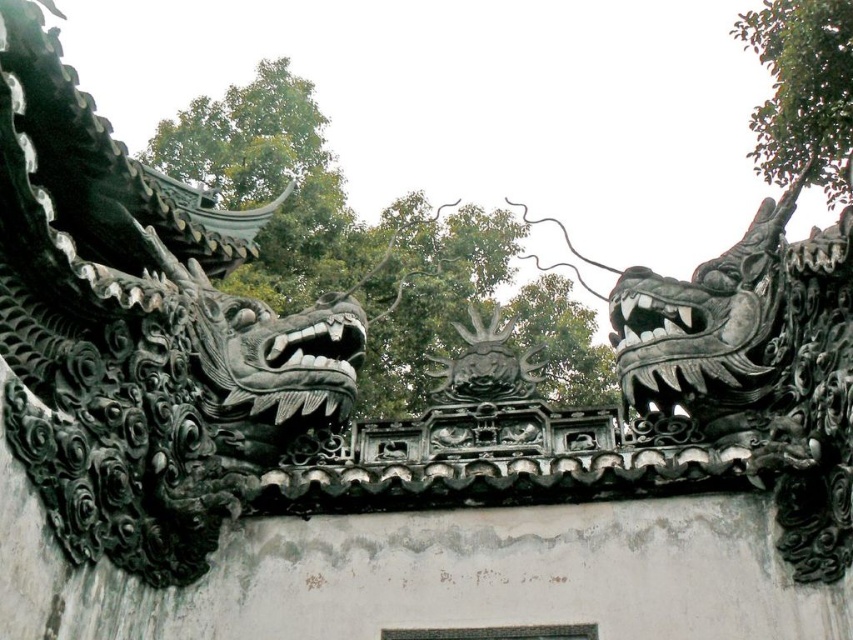
Question: Can you confirm if black stone dragon head at left is thinner than black matte dragon head at center?

Choices:
 (A) no
 (B) yes

Answer: (A)

Question: Is black stone dragon mouth at center thinner than matte black dragon mouth at center?

Choices:
 (A) yes
 (B) no

Answer: (A)

Question: Which point appears closest to the camera in this image?

Choices:
 (A) (289, 356)
 (B) (816, 342)
 (C) (187, 378)

Answer: (B)

Question: Can you confirm if black stone dragon mouth at center is positioned to the left of matte black dragon mouth at center?

Choices:
 (A) yes
 (B) no

Answer: (B)

Question: Which of these objects is positioned farthest from the black stone dragon head at upper right?

Choices:
 (A) black stone dragon mouth at center
 (B) black stone dragon head at left
 (C) matte black dragon mouth at center
 (D) black matte dragon head at center

Answer: (B)

Question: Among these points, which one is nearest to the camera?

Choices:
 (A) (659, 333)
 (B) (825, 298)

Answer: (B)